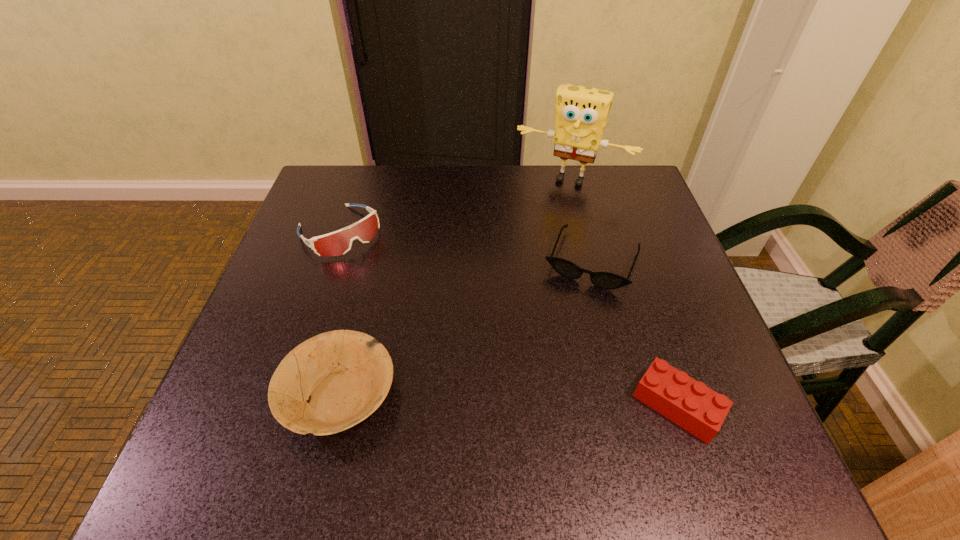
You are a GUI agent. You are given a task and a screenshot of the screen. Output one action in this format:
    pyautogui.click(x=<x>, y=<y>)
    Task: Click on the bowl
    
    Given the screenshot: What is the action you would take?
    pyautogui.click(x=345, y=375)

Find the location of `Lego`. Lego is located at coordinates (692, 405).

Locate an element on the screen. The width and height of the screenshot is (960, 540). sunglasses is located at coordinates 605,280.

I want to click on goggles, so click(339, 243).

You are a GUI agent. You are given a task and a screenshot of the screen. Output one action in this format:
    pyautogui.click(x=<x>, y=<y>)
    Task: Click on the tallest object
    This screenshot has width=960, height=540.
    Given the screenshot: What is the action you would take?
    pyautogui.click(x=581, y=115)

The width and height of the screenshot is (960, 540). What are the coordinates of `the farthest object` in the screenshot? It's located at (581, 115).

Locate an element on the screen. The height and width of the screenshot is (540, 960). vacant space positioned on the right of the bowl is located at coordinates (495, 395).

In order to click on vacant space situated 0.250m on the left of the Lego in this screenshot , I will do `click(489, 406)`.

You are a GUI agent. You are given a task and a screenshot of the screen. Output one action in this format:
    pyautogui.click(x=<x>, y=<y>)
    Task: Click on the free region located 0.140m on the front-facing side of the sunglasses
    
    Given the screenshot: What is the action you would take?
    pyautogui.click(x=559, y=342)

Where is `blank space located on the front-facing side of the sunglasses`? The width and height of the screenshot is (960, 540). blank space located on the front-facing side of the sunglasses is located at coordinates (527, 424).